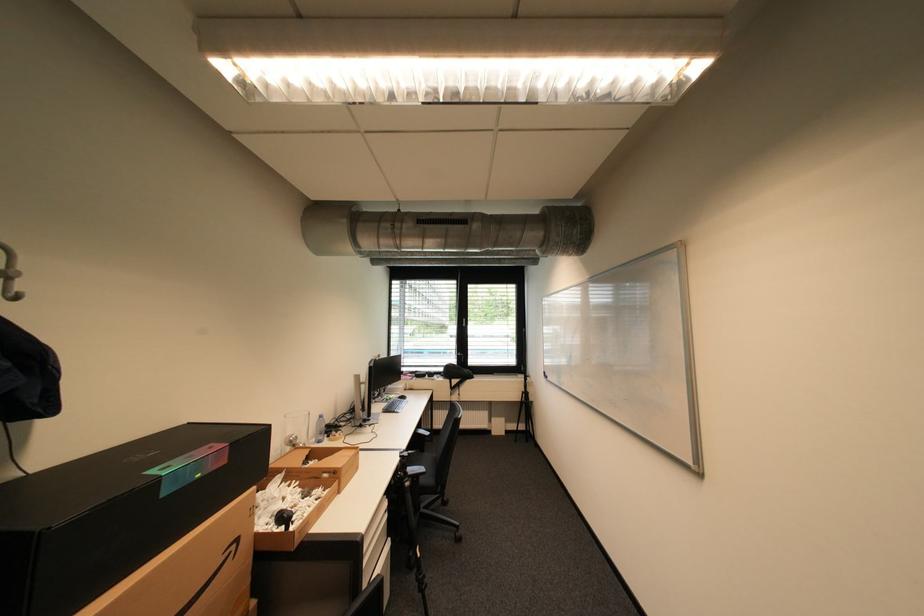
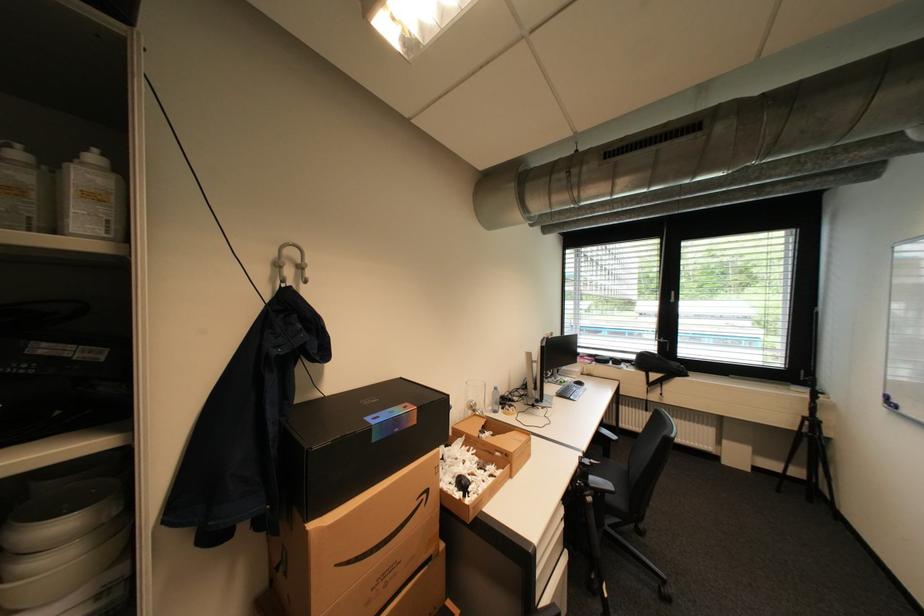
Where in the second image is the point corresponding to point (531, 391) from the first image?

(815, 415)